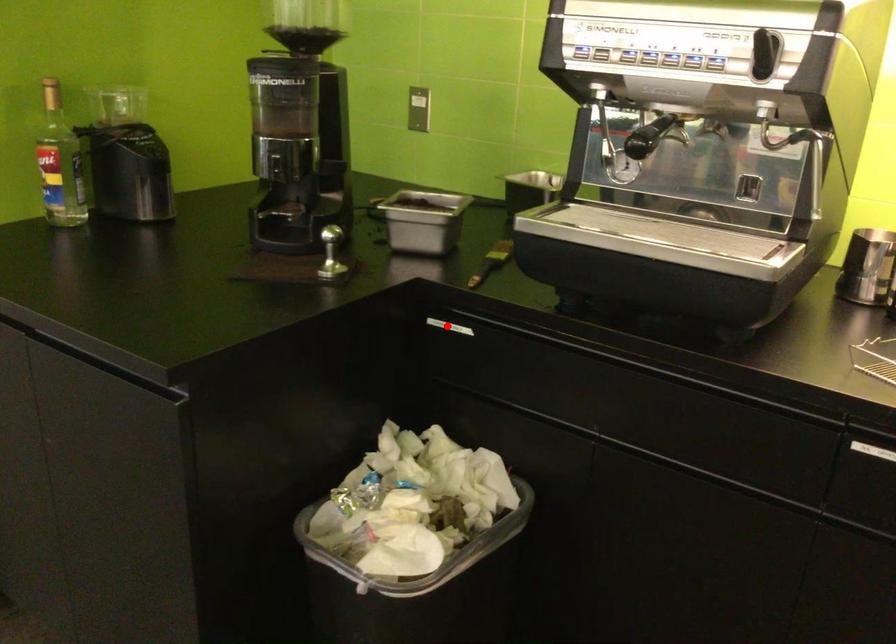
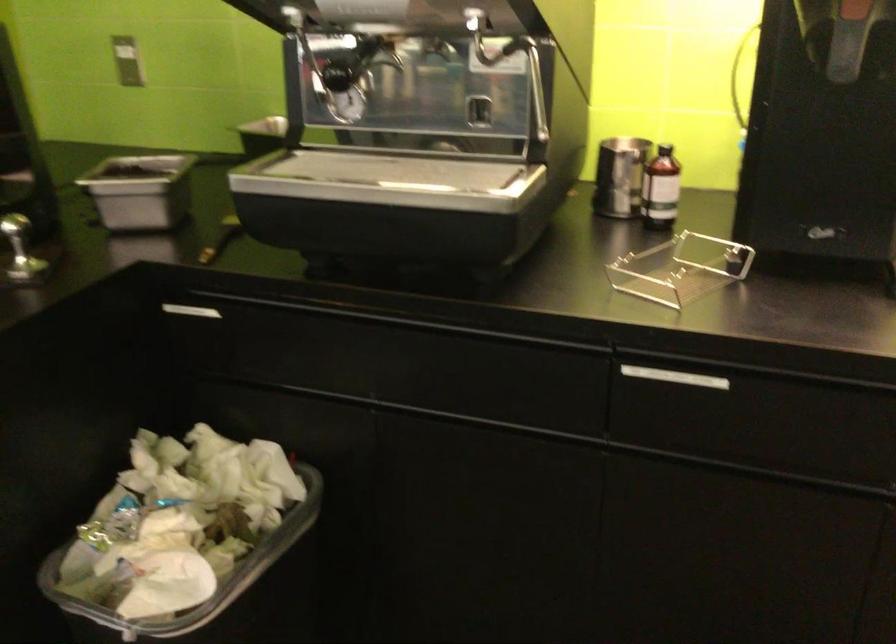
Find the pixel in the second image that matches the highlighted location in the first image.

(192, 310)